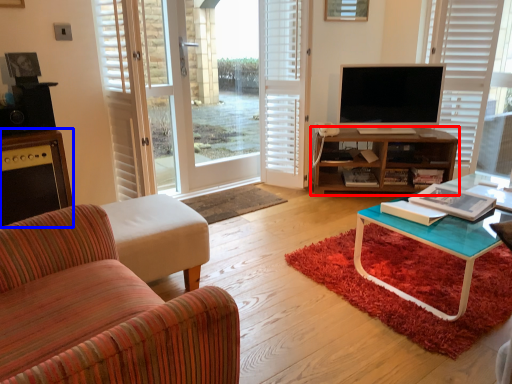
Question: Which object appears closest to the camera in this image, shelf (highlighted by a red box) or cabinetry (highlighted by a blue box)?

Choices:
 (A) shelf
 (B) cabinetry

Answer: (B)